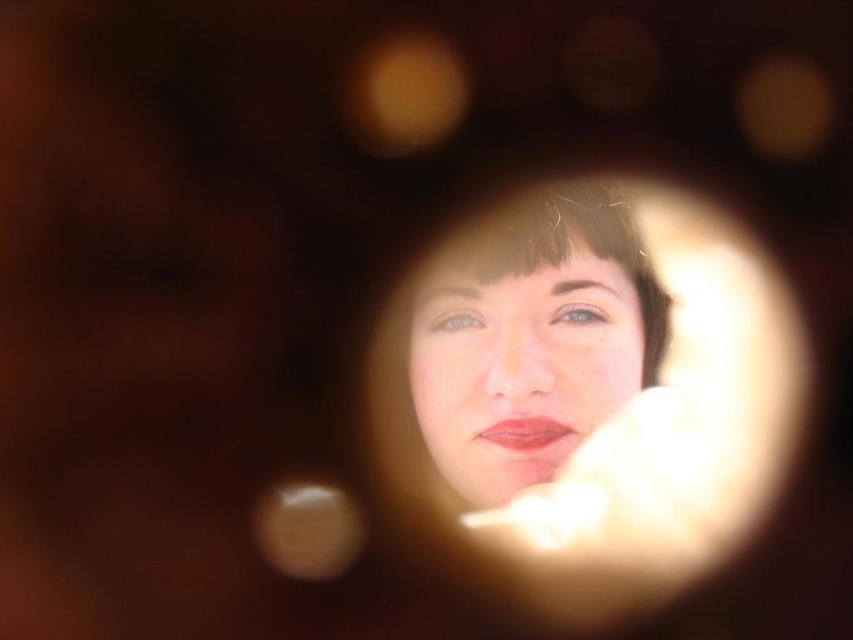
Consider the image. You are a photographer adjusting the focus of your camera. The subject has a smooth skin face at center. Where should you adjust the focus point to ensure the face is in sharp focus?

The smooth skin face at center is positioned at point [521,360], so you should adjust the focus point to that coordinate to ensure the face is in sharp focus.

You are a photographer trying to capture the perfect portrait. You notice the smooth skin face at center and the matte red lipstick at center in your frame. Which object is more to the left?

The matte red lipstick at center is more to the left since the smooth skin face at center is positioned on the right side of it.

You are a photographer using a camera with a focal length of 85mm. You are positioned such that the smooth skin face at center fills the frame perfectly. If you want to maintain the same framing but move closer to the subject so that you are now 40 centimeters away from them, what adjustment must you make to the focal length of your lens?

To maintain the same framing while moving closer to the subject from 53.61 cm to 40 cm, you must decrease the focal length. The original distance was 53.61 cm with an 85mm focal length. Moving closer to 40 cm requires a shorter focal length to keep the subject the same size in the frame. The new focal length can be calculated using the ratio of the distances multiplied by the original focal length, resulting in approximately 63.7mm.